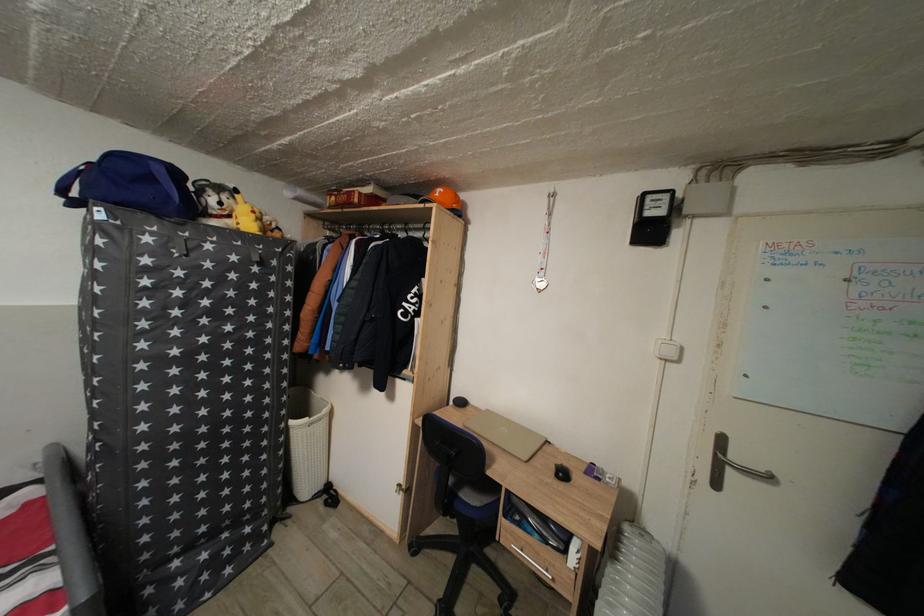
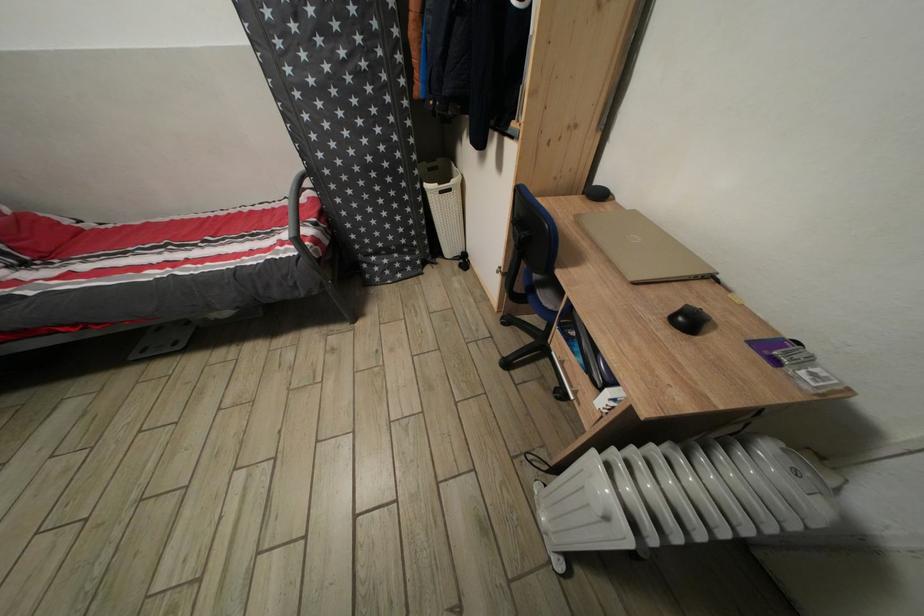
The point at (569, 480) is marked in the first image. Where is the corresponding point in the second image?

(696, 328)